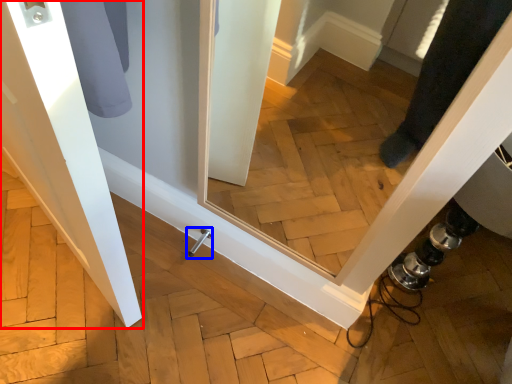
Question: Which of the following is the farthest to the observer, door (highlighted by a red box) or door handle (highlighted by a blue box)?

Choices:
 (A) door
 (B) door handle

Answer: (B)